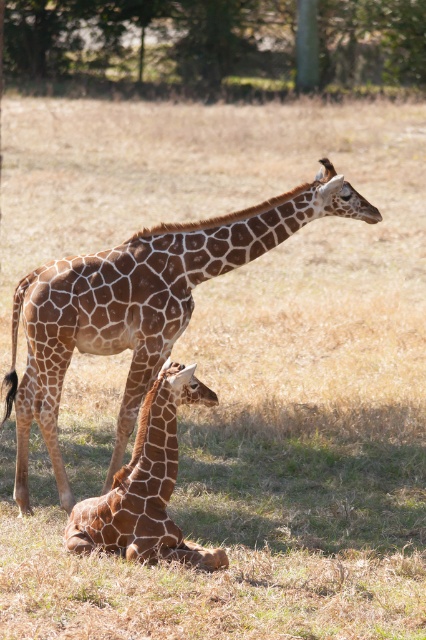
You are a photographer trying to capture both the larger giraffe and the smaller giraffe in your shot. You notice two points marked in the image at coordinates point (167, 45) and point (255, 243). Which of these points is closer to you, the photographer?

Point (167, 45) is closer to you than point (255, 243) because it is further to the viewer.

You are a bird flying over the savanna and want to land on the nearest tree to the point marked at coordinates [213,45]. Which tree should you choose?

The green leafy tree at upper center is located exactly at point [213,45], so you should land there.